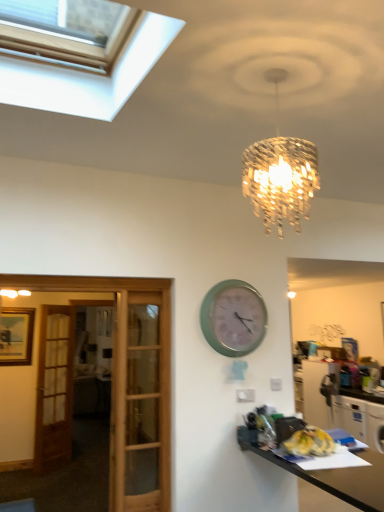
Question: Does black glossy desk at lower right have a larger size compared to green matte wall clock at center?

Choices:
 (A) yes
 (B) no

Answer: (A)

Question: Is black glossy desk at lower right far away from green matte wall clock at center?

Choices:
 (A) no
 (B) yes

Answer: (A)

Question: Is black glossy desk at lower right to the left of green matte wall clock at center from the viewer's perspective?

Choices:
 (A) yes
 (B) no

Answer: (B)

Question: Considering the relative sizes of black glossy desk at lower right and green matte wall clock at center in the image provided, is black glossy desk at lower right wider than green matte wall clock at center?

Choices:
 (A) yes
 (B) no

Answer: (A)

Question: Would you say green matte wall clock at center is part of black glossy desk at lower right's contents?

Choices:
 (A) yes
 (B) no

Answer: (B)

Question: Considering the relative positions of black glossy desk at lower right and green matte wall clock at center in the image provided, is black glossy desk at lower right to the left or to the right of green matte wall clock at center?

Choices:
 (A) right
 (B) left

Answer: (A)

Question: Is black glossy desk at lower right taller or shorter than green matte wall clock at center?

Choices:
 (A) short
 (B) tall

Answer: (B)

Question: Is black glossy desk at lower right inside the boundaries of green matte wall clock at center, or outside?

Choices:
 (A) inside
 (B) outside

Answer: (B)

Question: In terms of width, does black glossy desk at lower right look wider or thinner when compared to green matte wall clock at center?

Choices:
 (A) wide
 (B) thin

Answer: (A)

Question: Considering the positions of point (51, 412) and point (365, 458), is point (51, 412) closer or farther from the camera than point (365, 458)?

Choices:
 (A) closer
 (B) farther

Answer: (B)

Question: Looking at their shapes, would you say brown wooden door at left is wider or thinner than black glossy desk at lower right?

Choices:
 (A) wide
 (B) thin

Answer: (B)

Question: In terms of size, does brown wooden door at left appear bigger or smaller than black glossy desk at lower right?

Choices:
 (A) small
 (B) big

Answer: (A)

Question: From the image's perspective, is brown wooden door at left above or below black glossy desk at lower right?

Choices:
 (A) below
 (B) above

Answer: (A)

Question: Choose the correct answer: Is green matte wall clock at center inside black glossy desk at lower right or outside it?

Choices:
 (A) inside
 (B) outside

Answer: (B)

Question: From a real-world perspective, is green matte wall clock at center above or below black glossy desk at lower right?

Choices:
 (A) below
 (B) above

Answer: (B)